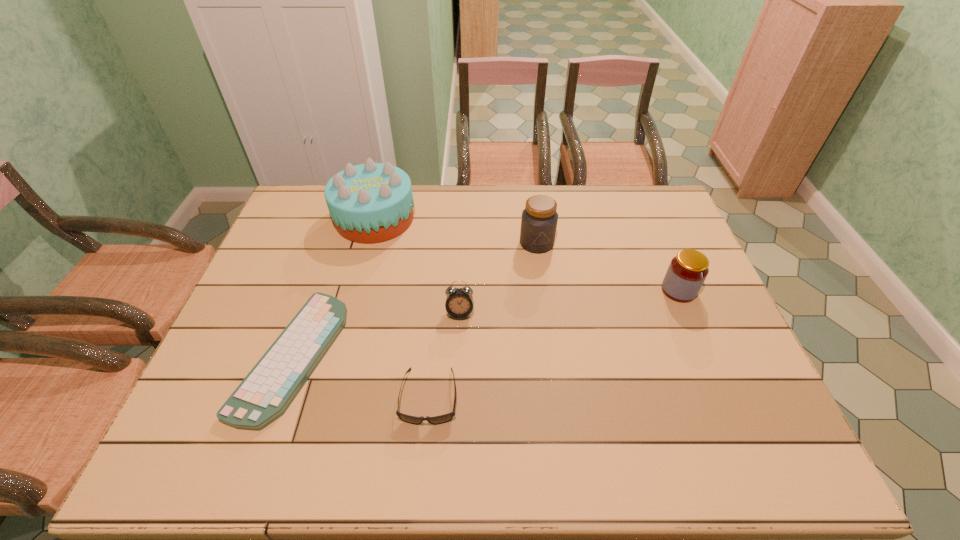
At what (x,y) coordinates should I click in order to perform the action: click on free space at the near edge of the desktop. Please return your answer as a coordinate pair (x, y). The height and width of the screenshot is (540, 960). Looking at the image, I should click on (x=277, y=446).

This screenshot has height=540, width=960. Identify the location of vacant space at the left edge of the desktop. (300, 292).

I want to click on free location at the right edge, so click(678, 253).

Find the location of a particular element. This screenshot has height=540, width=960. vacant space at the far left corner of the desktop is located at coordinates (314, 192).

Locate an element on the screen. The height and width of the screenshot is (540, 960). vacant space at the near left corner of the desktop is located at coordinates (204, 444).

You are a GUI agent. You are given a task and a screenshot of the screen. Output one action in this format:
    pyautogui.click(x=<x>, y=<y>)
    Task: Click on the vacant space at the far right corner
    The width and height of the screenshot is (960, 540).
    Given the screenshot: What is the action you would take?
    pyautogui.click(x=660, y=198)

Find the location of a particular element. Image resolution: width=960 pixels, height=540 pixels. free space between the second shortest object and the shorter jar is located at coordinates (554, 343).

This screenshot has width=960, height=540. In order to click on free area in between the shortest object and the fifth tallest object in this screenshot , I will do `click(361, 377)`.

Locate an element on the screen. free spot between the cake and the computer keyboard is located at coordinates (334, 287).

Locate an element on the screen. The width and height of the screenshot is (960, 540). blank region between the rightmost object and the left jar is located at coordinates (608, 267).